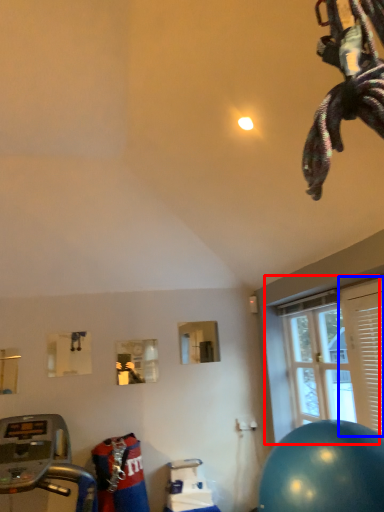
Question: Which of the following is the closest to the observer, window (highlighted by a red box) or shutter (highlighted by a blue box)?

Choices:
 (A) window
 (B) shutter

Answer: (B)